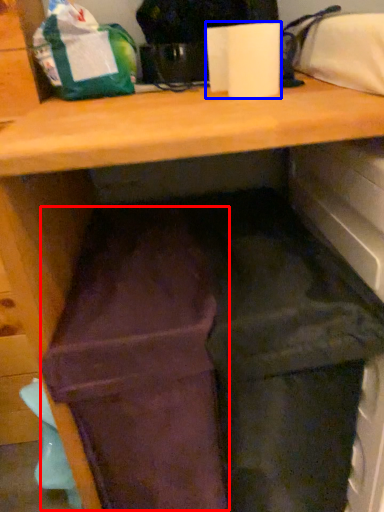
Question: Which of the following is the farthest to the observer, wide (highlighted by a red box) or paper towel (highlighted by a blue box)?

Choices:
 (A) wide
 (B) paper towel

Answer: (B)